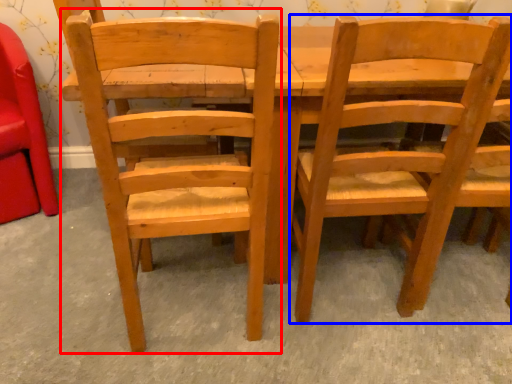
Question: Which point is further to the camera, chair (highlighted by a red box) or chair (highlighted by a blue box)?

Choices:
 (A) chair
 (B) chair

Answer: (B)